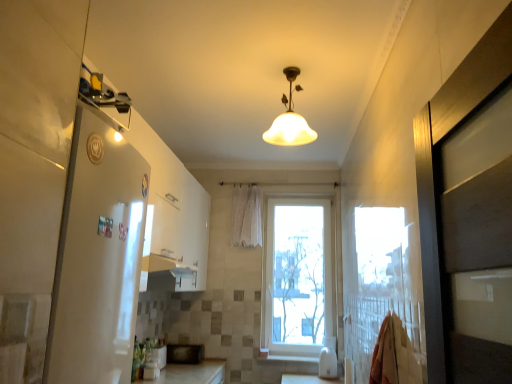
This screenshot has width=512, height=384. I want to click on vacant point above white plastic window at center (from a real-world perspective), so click(305, 193).